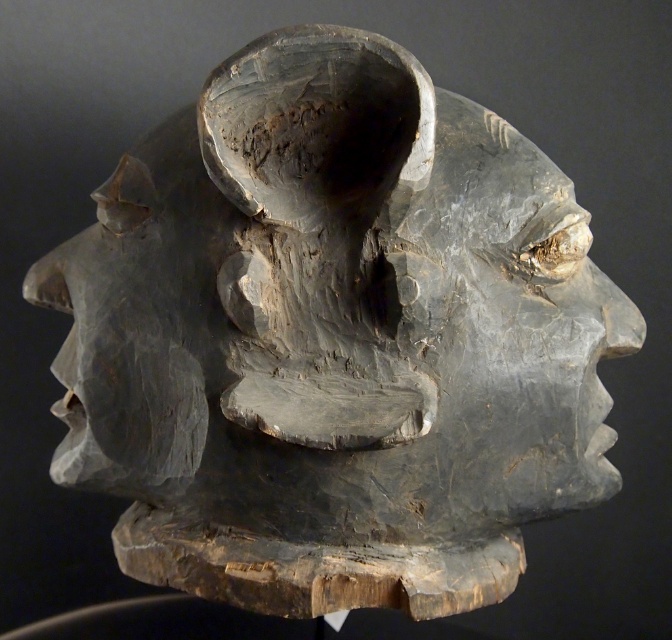
You are an art curator arranging an exhibition. You have to place the gray wood carving at center and the matte gray stone face at left in a way that follows the museum layout rules. According to the rules, objects must be arranged from top to bottom based on their height. Which object should be placed higher?

The gray wood carving at center is below the matte gray stone face at left, so the matte gray stone face at left should be placed higher since it is positioned above the gray wood carving at center.

You are an art conservator standing at a standard distance of 36 inches from the gray wood carving at center to examine it. Can you comfortably step back to get a better view without moving the sculpture?

The gray wood carving at center is 31.46 inches away from the camera, so if you are currently standing at 36 inches, you are already further back than the measurement provided. Therefore, you cannot step back any further without moving the sculpture or yourself beyond the current position.

You are an art conservator examining the wooden sculpture. You notice two points on the sculpture marked at coordinates point (446, 173) and point (206, 384). Which point is closer to the surface of the sculpture?

Point (446, 173) is further to the camera than point (206, 384), so the point closer to the surface is point (206, 384) because it is nearer to the viewer.